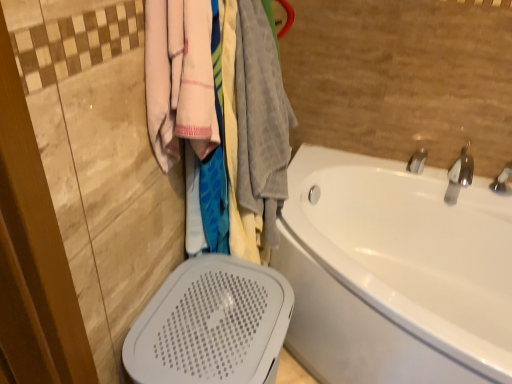
Question: Considering the positions of white glossy bathtub at right and silver metallic faucet at upper right, acting as the second tap starting from the left, in the image, is white glossy bathtub at right bigger or smaller than silver metallic faucet at upper right, acting as the second tap starting from the left,?

Choices:
 (A) small
 (B) big

Answer: (B)

Question: Is white glossy bathtub at right wider or thinner than silver metallic faucet at upper right, acting as the second tap starting from the left?

Choices:
 (A) wide
 (B) thin

Answer: (A)

Question: Which is farther from the silver metallic faucet at upper right, which ranks as the 1th tap in right-to-left order?

Choices:
 (A) soft cotton towels at upper left
 (B) soft pink towel at upper left
 (C) silver metallic tap at upper right, which is the 2th tap from right to left
 (D) white glossy bathtub at right

Answer: (B)

Question: Based on their relative distances, which object is nearer to the silver metallic tap at upper right, which is counted as the 1th tap, starting from the left?

Choices:
 (A) soft cotton towels at upper left
 (B) silver metallic faucet at upper right, which ranks as the 1th tap in right-to-left order
 (C) soft pink towel at upper left
 (D) white glossy bathtub at right

Answer: (B)